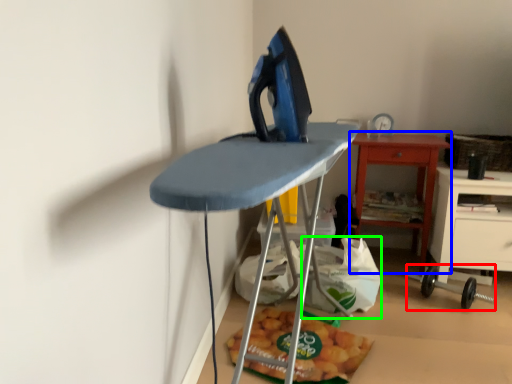
Question: Estimate the real-world distances between objects in this image. Which object is closer to equipment (highlighted by a red box), table (highlighted by a blue box) or grocery bag (highlighted by a green box)?

Choices:
 (A) table
 (B) grocery bag

Answer: (A)